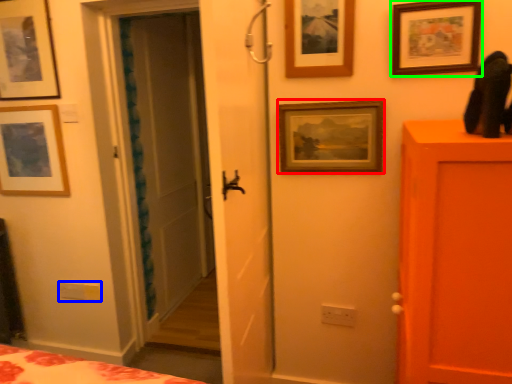
Question: Considering the real-world distances, which object is closest to picture frame (highlighted by a red box)? light switch (highlighted by a blue box) or picture frame (highlighted by a green box).

Choices:
 (A) light switch
 (B) picture frame

Answer: (B)